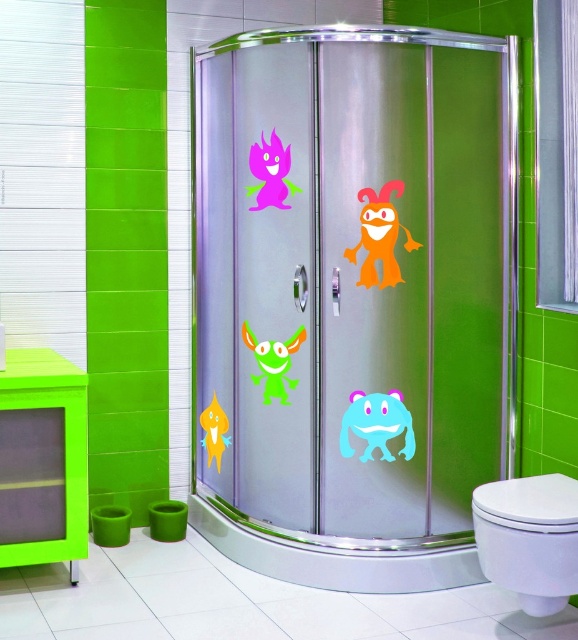
You are a visitor in this bathroom and need to locate the toilet. You see the yellow matte fish at lower center. Where would you find the white glossy toilet bowl at lower right relative to the fish?

The white glossy toilet bowl at lower right is located below the yellow matte fish at lower center.

You are a bathroom designer planning to install a new shelf between the white glossy toilet bowl at lower right and the yellow matte fish at lower center. Based on their widths, which object should the shelf be placed closer to to ensure it fits properly?

The white glossy toilet bowl at lower right might be wider than the yellow matte fish at lower center, so the shelf should be placed closer to the yellow matte fish at lower center to accommodate the toilet bowl.

You are a home inspector assessing the bathroom layout. You need to determine if the yellow matte fish at lower center can be seen from the white glossy toilet bowl at lower right. Based on their heights, can the fish be visible from the toilet bowl?

The white glossy toilet bowl at lower right is taller than the yellow matte fish at lower center. Since the toilet bowl is taller, the fish might be partially or fully obscured depending on the exact positioning, but based solely on height, the fish could be visible from the toilet bowl if there are no obstructions.